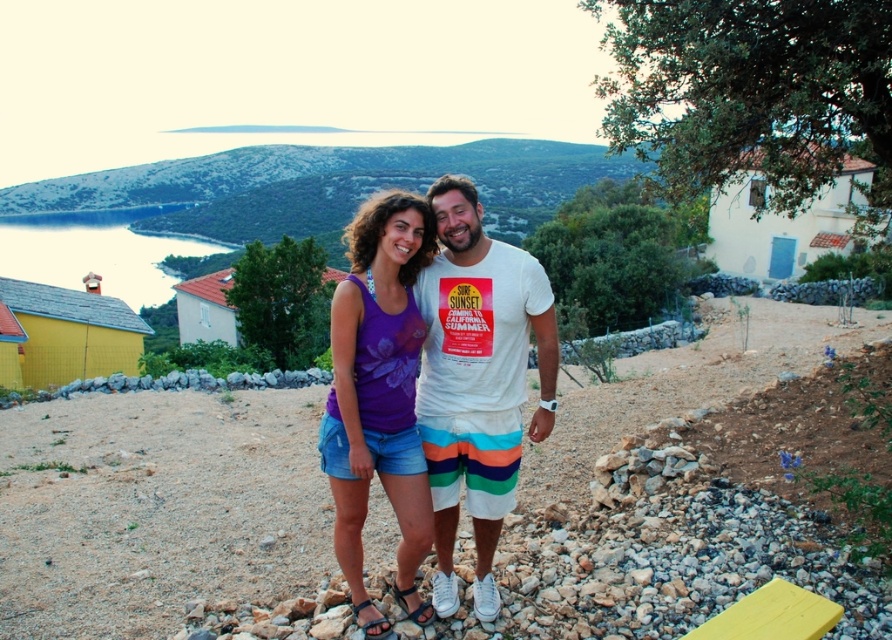
Question: Which point is farther to the camera?

Choices:
 (A) (424, 250)
 (B) (550, 394)

Answer: (B)

Question: Does white cotton t-shirt at center appear on the right side of purple floral tank top at center?

Choices:
 (A) no
 (B) yes

Answer: (B)

Question: Is white cotton t-shirt at center positioned at the back of purple floral tank top at center?

Choices:
 (A) no
 (B) yes

Answer: (B)

Question: Does white cotton t-shirt at center lie behind purple floral tank top at center?

Choices:
 (A) no
 (B) yes

Answer: (B)

Question: Which object is closer to the camera taking this photo?

Choices:
 (A) white cotton t-shirt at center
 (B) purple floral tank top at center

Answer: (B)

Question: Which point appears farthest from the camera in this image?

Choices:
 (A) (469, 480)
 (B) (381, 355)

Answer: (A)